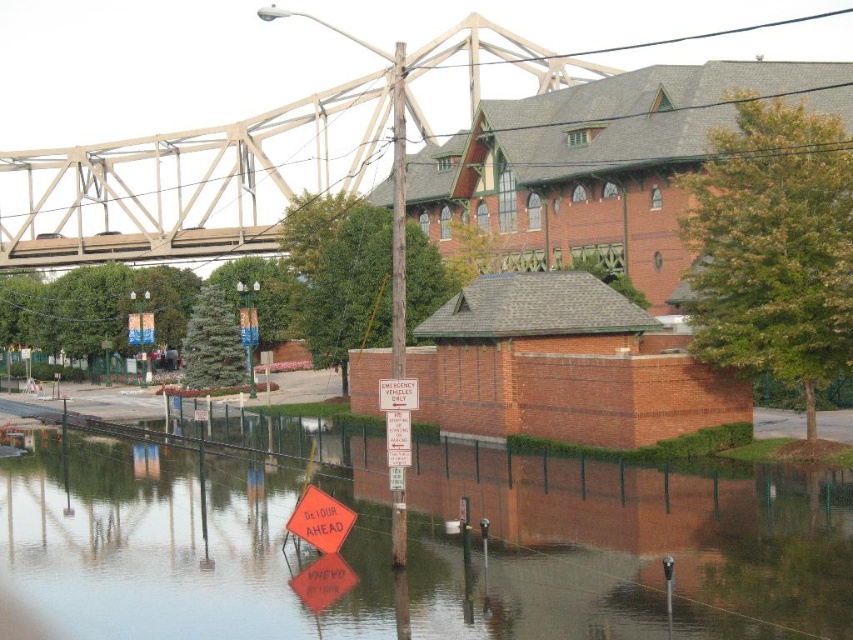
Question: In this image, where is translucent plastic water at lower center located relative to metallic gray bridge at upper center?

Choices:
 (A) below
 (B) above

Answer: (A)

Question: Can you confirm if translucent plastic water at lower center is positioned below metallic gray bridge at upper center?

Choices:
 (A) yes
 (B) no

Answer: (A)

Question: Which point appears closest to the camera in this image?

Choices:
 (A) (785, 624)
 (B) (234, 179)

Answer: (A)

Question: Is translucent plastic water at lower center further to camera compared to metallic gray bridge at upper center?

Choices:
 (A) no
 (B) yes

Answer: (A)